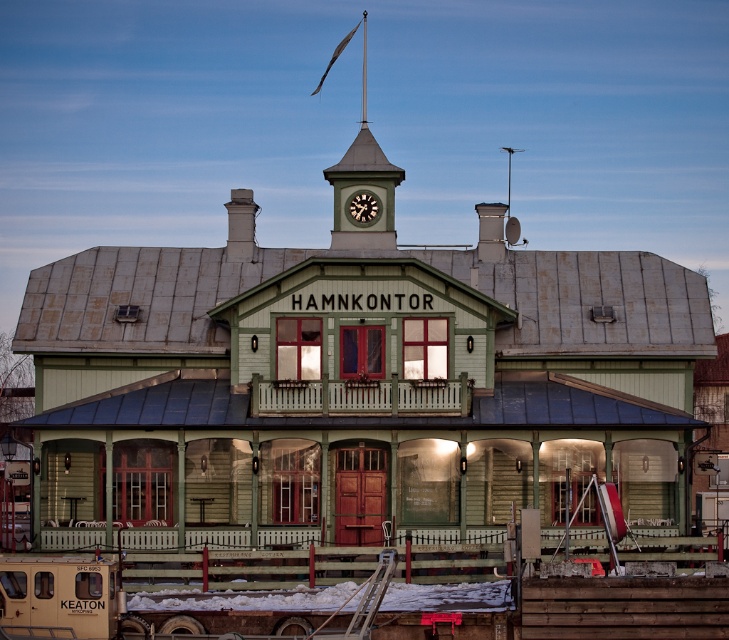
You are a tourist standing in front of the HAMNKONTOR building. You notice the metallic spire at upper center and the matte black clock at upper center. Which object is located higher up on the building?

The metallic spire at upper center is positioned over the matte black clock at upper center, so it is higher up on the building.

You are standing in front of the HAMNKONTOR building and notice two points marked on the facade. The first point is at coordinate (x=358, y=241) and the second at (x=370, y=200). Which of these two points is closer to your current position?

Point (x=358, y=241) is closer to the camera than point (x=370, y=200).

Based on the scene description, where exactly is the metallic spire at upper center located in terms of coordinates?

The metallic spire at upper center is located at point coordinates of [362,188].